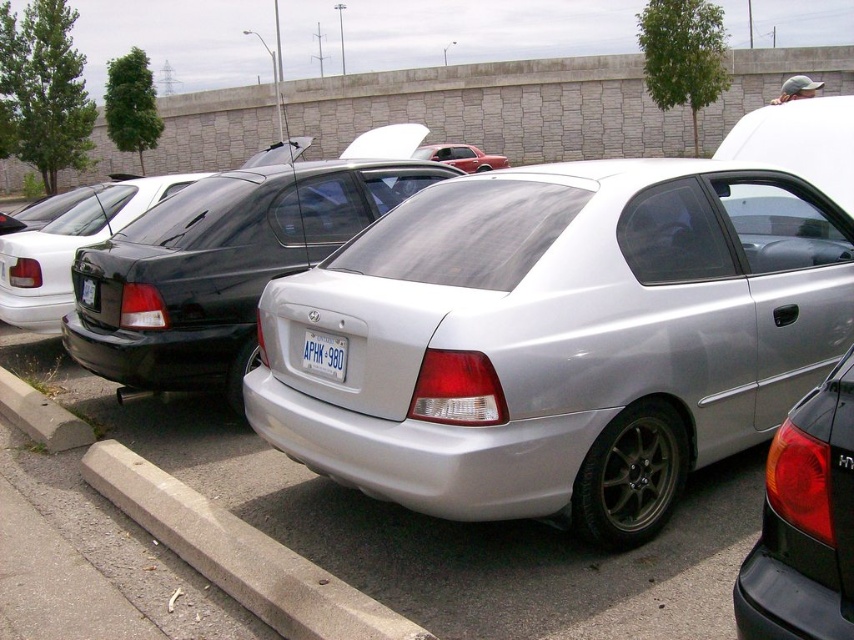
Measure the distance between silver metallic car at center and satin silver car at center.

silver metallic car at center is 2.95 meters away from satin silver car at center.

Does silver metallic car at center have a lesser height compared to satin silver car at center?

No.

Does point (501, 300) lie in front of point (301, 230)?

Yes, point (501, 300) is closer to viewer.

Image resolution: width=854 pixels, height=640 pixels. In order to click on silver metallic car at center in this screenshot , I will do `click(559, 339)`.

Who is positioned more to the right, concrete at lower center or white plastic license plate at center?

white plastic license plate at center

Between concrete at lower center and white plastic license plate at center, which one is positioned higher?

white plastic license plate at center is above.

Where is `concrete at lower center`? This screenshot has width=854, height=640. concrete at lower center is located at coordinates (238, 554).

At what (x,y) coordinates should I click in order to perform the action: click on concrete at lower center. Please return your answer as a coordinate pair (x, y). The height and width of the screenshot is (640, 854). Looking at the image, I should click on click(238, 554).

Can you confirm if satin silver car at center is positioned above concrete at lower center?

Yes, satin silver car at center is above concrete at lower center.

Is satin silver car at center thinner than concrete at lower center?

Correct, satin silver car at center's width is less than concrete at lower center's.

Find the location of a particular element. Image resolution: width=854 pixels, height=640 pixels. satin silver car at center is located at coordinates (218, 268).

You are a GUI agent. You are given a task and a screenshot of the screen. Output one action in this format:
    pyautogui.click(x=<x>, y=<y>)
    Task: Click on the satin silver car at center
    This screenshot has width=854, height=640.
    Given the screenshot: What is the action you would take?
    pyautogui.click(x=218, y=268)